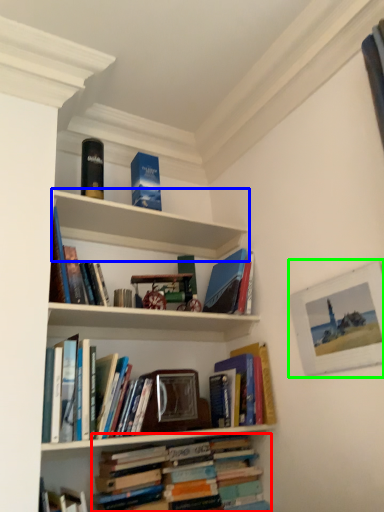
Question: Considering the real-world distances, which object is farthest from book (highlighted by a red box)? shelf (highlighted by a blue box) or picture frame (highlighted by a green box)?

Choices:
 (A) shelf
 (B) picture frame

Answer: (A)